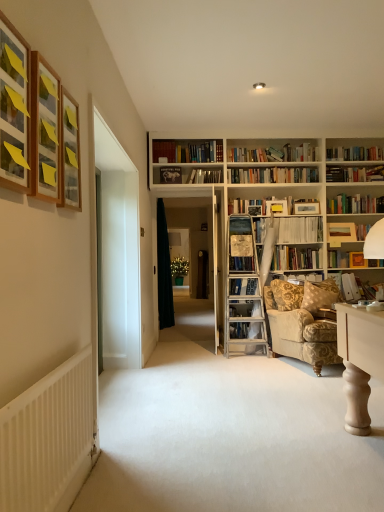
Question: Is white ribbed radiator at lower left located outside wooden picture frame at upper left, the third picture frame positioned from the back?

Choices:
 (A) yes
 (B) no

Answer: (A)

Question: From the image's perspective, is white ribbed radiator at lower left on top of wooden picture frame at upper left, the third picture frame positioned from the back?

Choices:
 (A) yes
 (B) no

Answer: (B)

Question: From a real-world perspective, is white ribbed radiator at lower left over wooden picture frame at upper left, the third picture frame positioned from the back?

Choices:
 (A) no
 (B) yes

Answer: (A)

Question: Can you confirm if white ribbed radiator at lower left is shorter than wooden picture frame at upper left, the third picture frame positioned from the back?

Choices:
 (A) no
 (B) yes

Answer: (A)

Question: Can you confirm if white ribbed radiator at lower left is smaller than wooden picture frame at upper left, the third picture frame positioned from the back?

Choices:
 (A) no
 (B) yes

Answer: (A)

Question: Does white ribbed radiator at lower left contain wooden picture frame at upper left, the third picture frame positioned from the back?

Choices:
 (A) yes
 (B) no

Answer: (B)

Question: Is wooden picture frame at upper left, the 4th picture frame when ordered from back to front, outside of black fabric curtain at center?

Choices:
 (A) yes
 (B) no

Answer: (A)

Question: Is wooden picture frame at upper left, which is the first picture frame from front to back, shorter than black fabric curtain at center?

Choices:
 (A) no
 (B) yes

Answer: (B)

Question: Is wooden picture frame at upper left, the 4th picture frame when ordered from back to front, directly adjacent to black fabric curtain at center?

Choices:
 (A) yes
 (B) no

Answer: (B)

Question: Does wooden picture frame at upper left, acting as the fourth picture frame starting from the right, lie behind black fabric curtain at center?

Choices:
 (A) no
 (B) yes

Answer: (A)

Question: Considering the relative sizes of wooden picture frame at upper left, the 4th picture frame when ordered from back to front, and black fabric curtain at center in the image provided, is wooden picture frame at upper left, the 4th picture frame when ordered from back to front, taller than black fabric curtain at center?

Choices:
 (A) no
 (B) yes

Answer: (A)

Question: From a real-world perspective, is wooden picture frame at upper left, which is the first picture frame from front to back, located beneath black fabric curtain at center?

Choices:
 (A) yes
 (B) no

Answer: (B)

Question: From a real-world perspective, does wooden picture frame at upper left, acting as the fourth picture frame starting from the right, sit lower than wooden book at upper right, which is the 3th book from left to right?

Choices:
 (A) yes
 (B) no

Answer: (B)